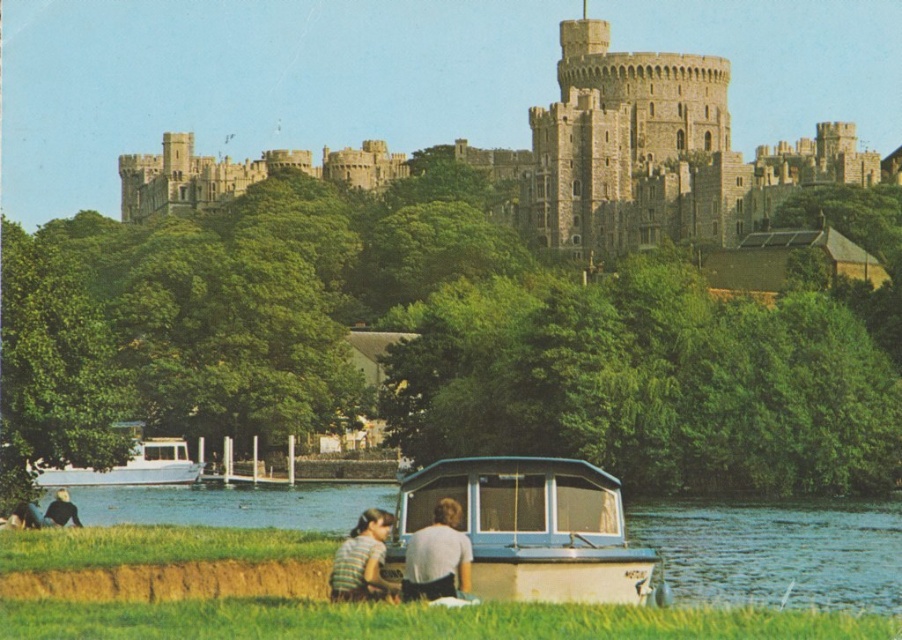
Does white glossy boat at lower left have a lesser height compared to light brown hair at lower left?

Incorrect, white glossy boat at lower left's height does not fall short of light brown hair at lower left's.

Identify the location of white glossy boat at lower left. (129, 465).

Which is behind, point (178, 458) or point (54, 502)?

Point (178, 458)

Locate an element on the screen. white glossy boat at lower left is located at coordinates (129, 465).

Does light blue plastic boat at lower center have a greater width compared to striped fabric couple at lower left?

Yes, light blue plastic boat at lower center is wider than striped fabric couple at lower left.

You are a GUI agent. You are given a task and a screenshot of the screen. Output one action in this format:
    pyautogui.click(x=<x>, y=<y>)
    Task: Click on the light blue plastic boat at lower center
    
    Given the screenshot: What is the action you would take?
    pyautogui.click(x=531, y=529)

You are a GUI agent. You are given a task and a screenshot of the screen. Output one action in this format:
    pyautogui.click(x=<x>, y=<y>)
    Task: Click on the light blue plastic boat at lower center
    This screenshot has height=640, width=902.
    Given the screenshot: What is the action you would take?
    pyautogui.click(x=531, y=529)

Is striped cotton shirt at lower center in front of striped fabric couple at lower left?

That is True.

Does striped cotton shirt at lower center appear over striped fabric couple at lower left?

Incorrect, striped cotton shirt at lower center is not positioned above striped fabric couple at lower left.

This screenshot has height=640, width=902. I want to click on striped cotton shirt at lower center, so click(x=403, y=560).

Image resolution: width=902 pixels, height=640 pixels. What are the coordinates of `striped cotton shirt at lower center` in the screenshot? It's located at (403, 560).